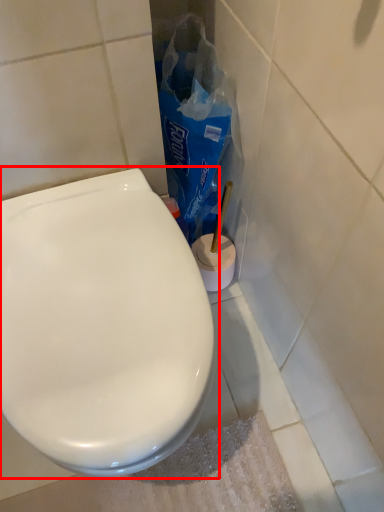
Question: In this image, where is toilet (annotated by the red box) located relative to paper bag?

Choices:
 (A) right
 (B) left

Answer: (B)